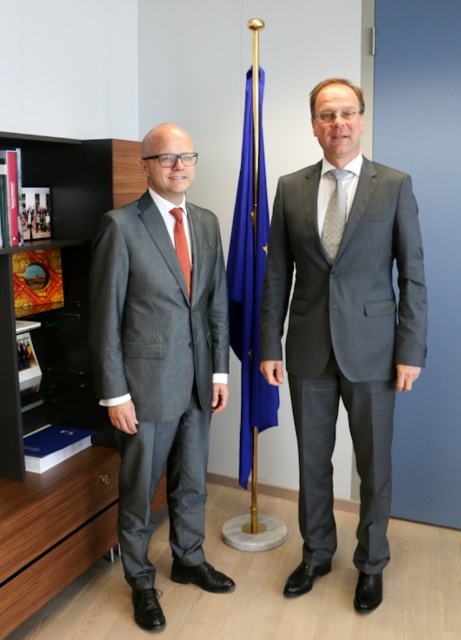
You are a tailor measuring the distance between two ties for a custom order. The client wants to know if the space between the gray textured tie at center and the orange silk tie at left is more than 20 inches. What do you tell them?

The distance between the gray textured tie at center and the orange silk tie at left is exactly 20.07 inches, which is just over 20 inches. Therefore, the space between them is more than 20 inches.